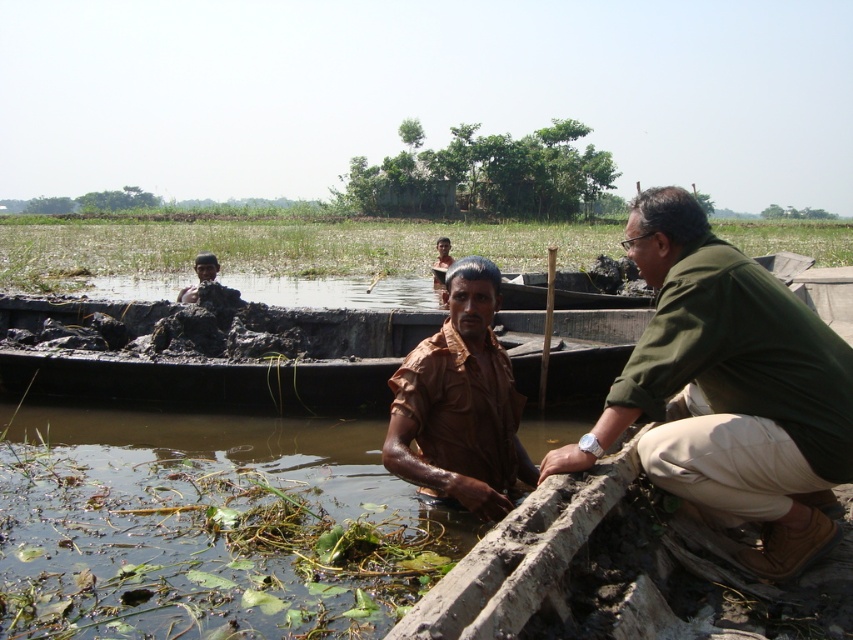
You are a photographer trying to capture a clear shot of the green fabric shirt at right and the dark brown mud at center. Which object should you focus on first to ensure both are in focus without adjusting your camera settings?

You should focus on the green fabric shirt at right first because it is closer to the viewer than the dark brown mud at center. By focusing on the closer object, the farther object may still be within the depth of field, ensuring both are in focus without needing to adjust the camera settings.